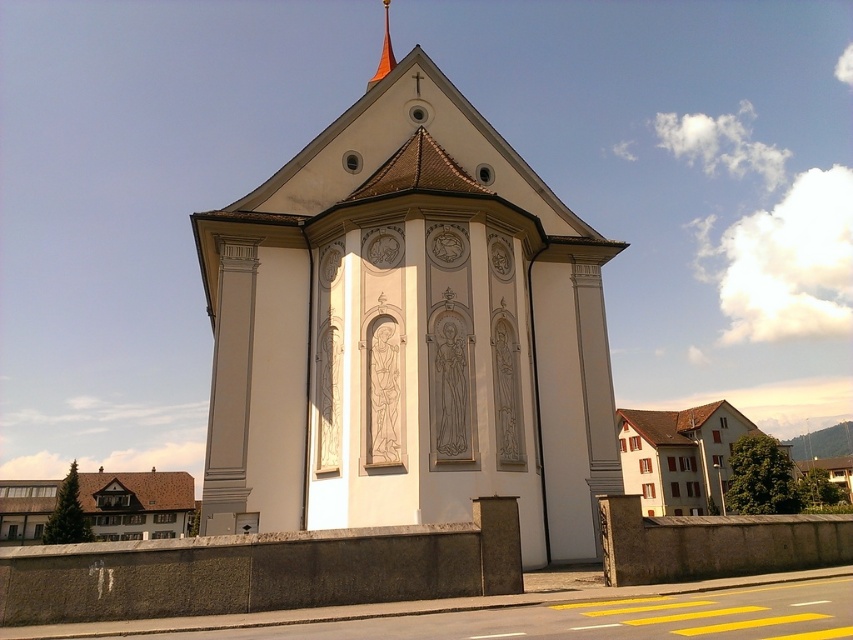
You are standing in front of the church and want to take a photo of the orange glossy spire at upper center without the brown shingles house at lower left blocking the view. Is this possible?

The orange glossy spire at upper center is behind the brown shingles house at lower left, so you cannot take a photo of the orange glossy spire at upper center without the brown shingles house at lower left blocking the view.

You are standing in front of the church and want to take a photo of the white stone chapel at center and the orange glossy spire at upper center. Which object will appear larger in your photo?

The white stone chapel at center will appear larger in the photo because it is closer to the viewer than the orange glossy spire at upper center.